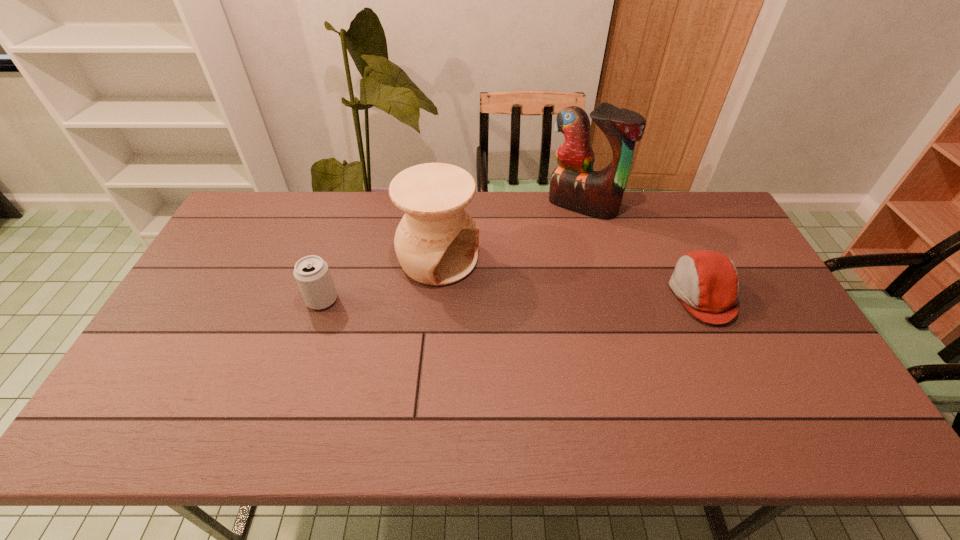
Find the location of `the second shortest object`. the second shortest object is located at coordinates (312, 274).

Locate an element on the screen. The height and width of the screenshot is (540, 960). can is located at coordinates (312, 274).

I want to click on the shortest object, so click(707, 282).

Find the location of a particular element. cap is located at coordinates (707, 282).

Locate an element on the screen. The width and height of the screenshot is (960, 540). the third shortest object is located at coordinates (436, 242).

The height and width of the screenshot is (540, 960). I want to click on pottery, so click(436, 242).

The height and width of the screenshot is (540, 960). I want to click on parrot, so click(x=574, y=185).

What are the coordinates of `the third object from left to right` in the screenshot? It's located at (574, 185).

This screenshot has height=540, width=960. In order to click on vacant region located 0.080m on the left of the leftmost object in this screenshot , I will do `click(278, 300)`.

You are a GUI agent. You are given a task and a screenshot of the screen. Output one action in this format:
    pyautogui.click(x=<x>, y=<y>)
    Task: Click on the free space located on the front-facing side of the cap
    The width and height of the screenshot is (960, 540).
    Given the screenshot: What is the action you would take?
    pyautogui.click(x=543, y=294)